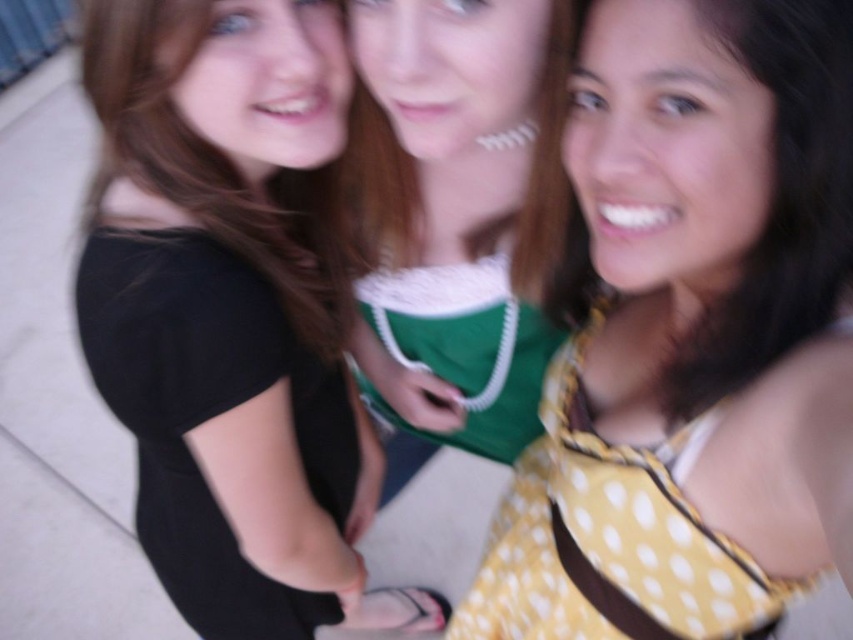
You are standing at the position of the black matte shirt at upper left and want to hand a small object to the person in the yellow dotted dress at right. Can you do so without moving from your current position?

The distance between the black matte shirt at upper left and the yellow dotted dress at right is 15.64 inches, so yes, you can hand the object without moving as the distance is manageable.

You are standing 1 meter away from the yellow dotted dress at center. Can you reach it without moving your feet?

The yellow dotted dress at center is 43.08 centimeters away from viewer. Since you are standing 1 meter away, which is farther than the distance to the dress, you cannot reach it without moving your feet.

In the scene shown: You are a photographer trying to capture a candid shot of the black matte shirt at upper left and the black matte dress at left. Which object should you focus on to ensure the subject in the upper position is sharp?

The black matte shirt at upper left is above the black matte dress at left, so focusing on the black matte shirt at upper left will ensure the upper subject is sharp.